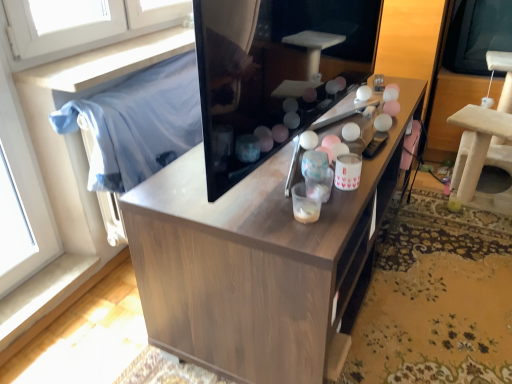
The height and width of the screenshot is (384, 512). Identify the location of free region under beige carpeted cat tree at right (from a real-world perspective). (474, 198).